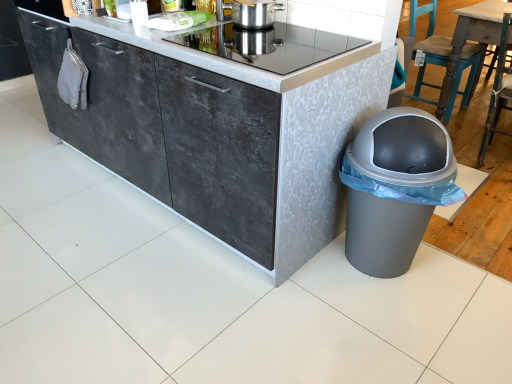
The height and width of the screenshot is (384, 512). Identify the location of vacant space to the right of gray plastic trash can at lower right. (461, 281).